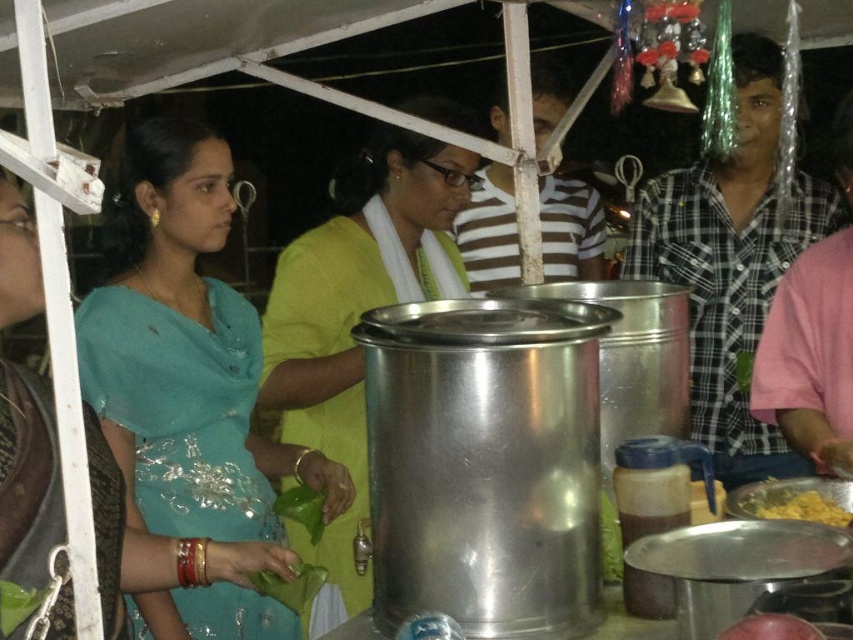
Consider the image. Can you confirm if checkered fabric shirt at right is positioned to the left of smooth red apple at center?

In fact, checkered fabric shirt at right is to the right of smooth red apple at center.

Locate an element on the screen. The height and width of the screenshot is (640, 853). checkered fabric shirt at right is located at coordinates (732, 260).

Who is more distant from viewer, (753, 278) or (738, 628)?

Positioned behind is point (753, 278).

You are a GUI agent. You are given a task and a screenshot of the screen. Output one action in this format:
    pyautogui.click(x=<x>, y=<y>)
    Task: Click on the checkered fabric shirt at right
    The width and height of the screenshot is (853, 640).
    Given the screenshot: What is the action you would take?
    pyautogui.click(x=732, y=260)

Who is positioned more to the right, teal silk saree at left or smooth red apple at center?

Positioned to the right is smooth red apple at center.

Can you confirm if teal silk saree at left is smaller than smooth red apple at center?

Incorrect, teal silk saree at left is not smaller in size than smooth red apple at center.

Is point (323, 481) positioned in front of point (775, 637)?

No, (323, 481) is further to viewer.

This screenshot has height=640, width=853. Find the location of `teal silk saree at left`. teal silk saree at left is located at coordinates (186, 355).

From the picture: Does matte green blouse at center appear on the left side of smooth red apple at center?

Yes, matte green blouse at center is to the left of smooth red apple at center.

Between point (274, 291) and point (795, 628), which one is positioned behind?

Point (274, 291)

This screenshot has width=853, height=640. Find the location of `matte green blouse at center`. matte green blouse at center is located at coordinates (355, 321).